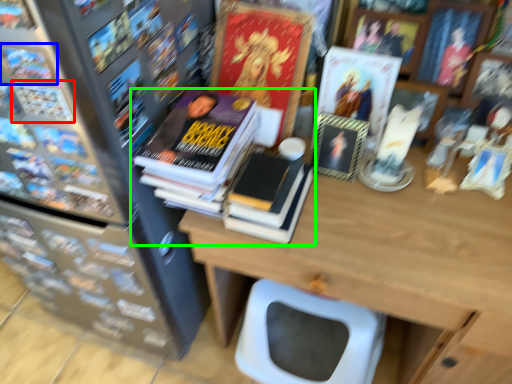
Question: Which object is the farthest from book (highlighted by a red box)? Choose among these: book (highlighted by a blue box) or book (highlighted by a green box).

Choices:
 (A) book
 (B) book

Answer: (B)